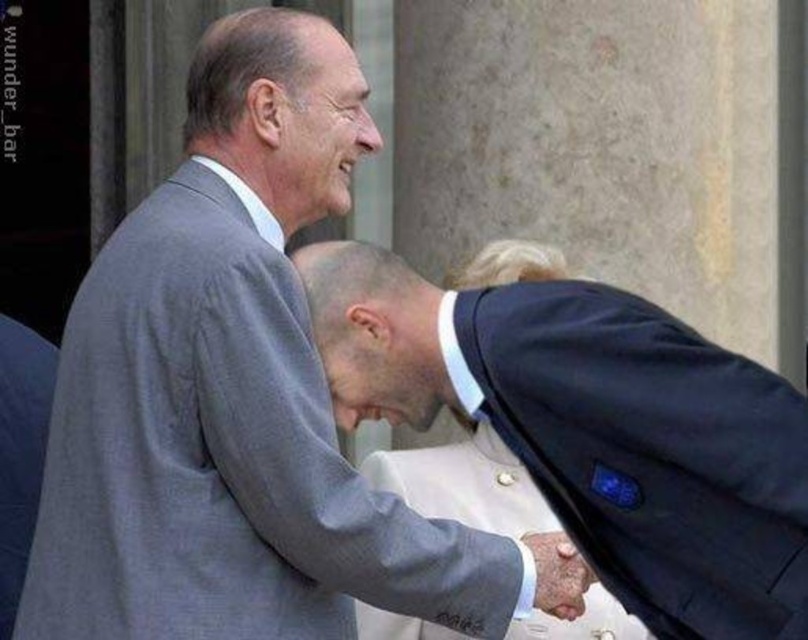
Question: Can you confirm if gray suit at center is thinner than smooth leather hand at center?

Choices:
 (A) no
 (B) yes

Answer: (B)

Question: Can you confirm if dark blue suit at center is positioned to the right of smooth leather hand at center?

Choices:
 (A) no
 (B) yes

Answer: (B)

Question: Which point is farther to the camera?

Choices:
 (A) (520, 296)
 (B) (577, 600)

Answer: (A)

Question: Among these points, which one is farthest from the camera?

Choices:
 (A) (78, 442)
 (B) (571, 612)
 (C) (490, 388)

Answer: (B)

Question: Is gray suit at center positioned at the back of smooth leather hand at center?

Choices:
 (A) yes
 (B) no

Answer: (A)

Question: Based on their relative distances, which object is farther from the smooth leather hand at center?

Choices:
 (A) gray suit at center
 (B) dark blue suit at center

Answer: (A)